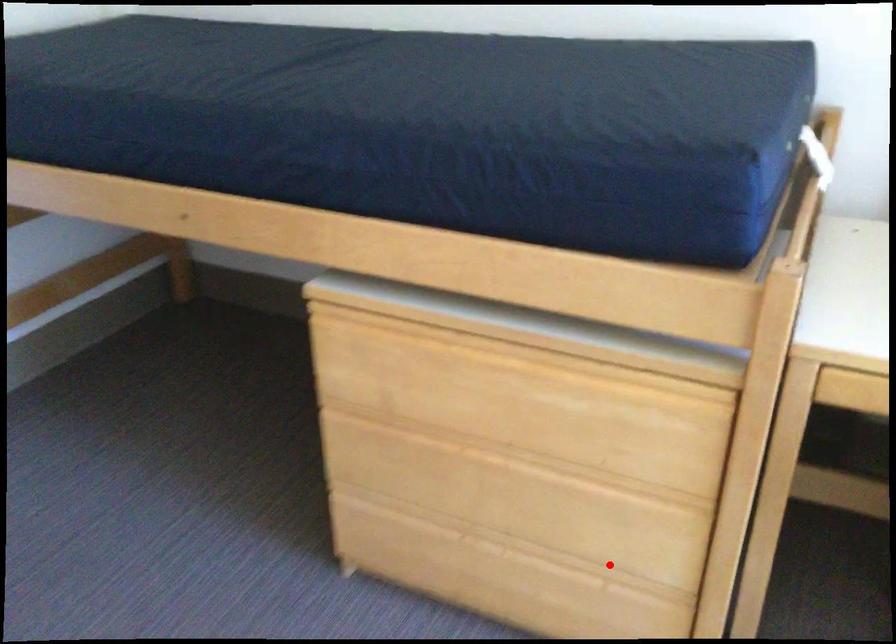
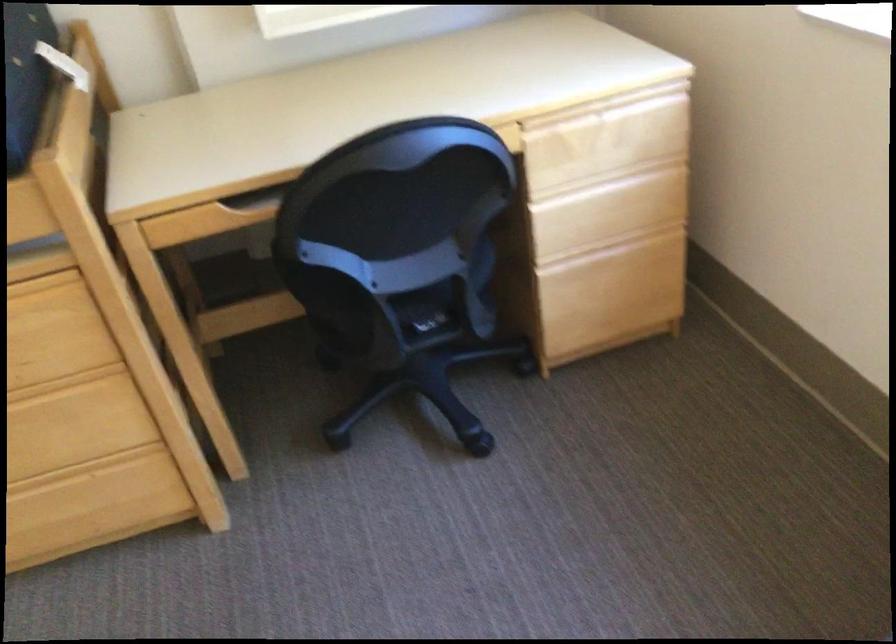
Find the pixel in the second image that matches the highlighted location in the first image.

(82, 469)